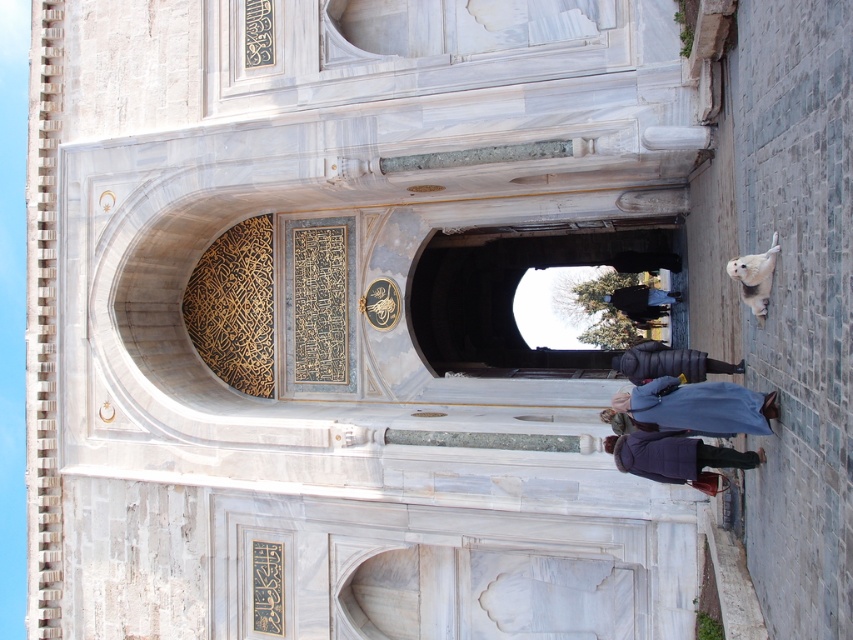
You are standing at the entrance of the grand architectural structure and notice a blue wool coat at lower right. Where exactly is the blue wool coat positioned relative to the entrance?

The blue wool coat at lower right is located at point coordinates approximately 0.637 on the x axis and 0.819 on the y axis relative to the entrance.

You are a tailor who needs to determine which garment to adjust first based on their widths. You have a blue wool coat at lower right and a dark blue down jacket at lower center in front of you. Which garment has a larger width?

The dark blue down jacket at lower center has a larger width than the blue wool coat at lower right according to the description.

You are a visitor standing in front of the grand entrance and see the blue wool coat at lower right and the dark blue down jacket at lower center. Which one is closer to you?

The blue wool coat at lower right is closer to you because it is in front of the dark blue down jacket at lower center.